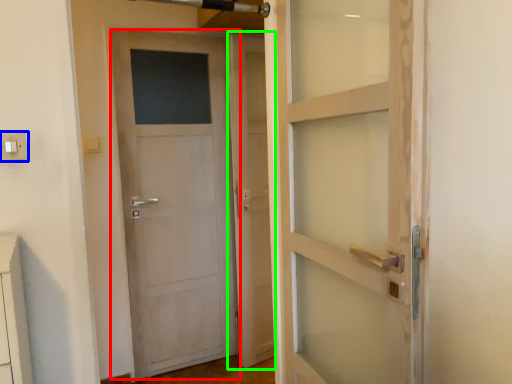
Question: Which is farther away from door (highlighted by a red box)? electric outlet (highlighted by a blue box) or screen door (highlighted by a green box)?

Choices:
 (A) electric outlet
 (B) screen door

Answer: (A)